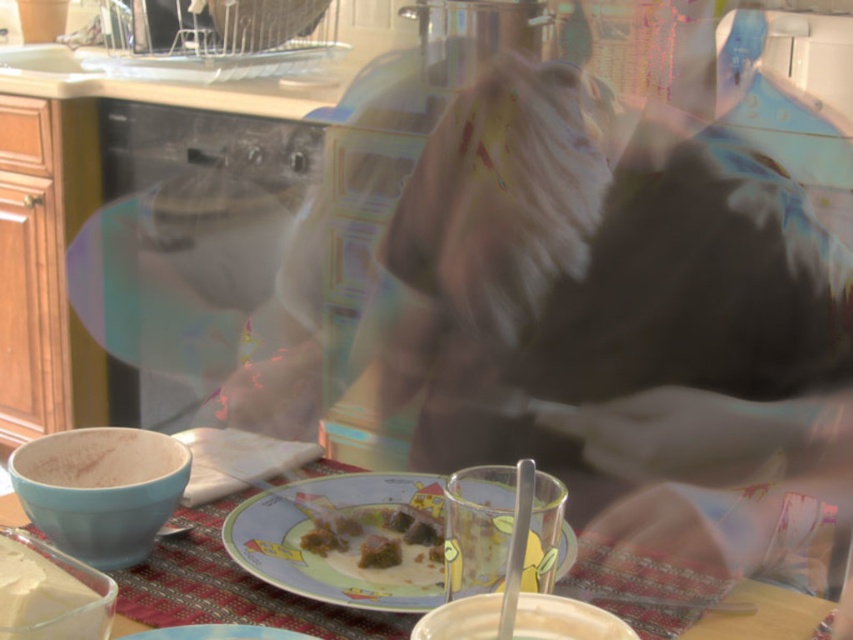
Question: Does decorative ceramic plate at center appear on the left side of smooth white cake at lower left?

Choices:
 (A) no
 (B) yes

Answer: (A)

Question: Does smooth white cake at lower left lie behind matte plastic plate at center?

Choices:
 (A) no
 (B) yes

Answer: (A)

Question: Does dark brown cake at center appear on the left side of matte plastic plate at center?

Choices:
 (A) yes
 (B) no

Answer: (B)

Question: Which of the following is the farthest from the observer?

Choices:
 (A) (759, 609)
 (B) (496, 520)
 (C) (331, 556)
 (D) (12, 545)

Answer: (C)

Question: Which point is closer to the camera?

Choices:
 (A) smooth white cake at lower left
 (B) decorative ceramic plate at center

Answer: (A)

Question: Among these objects, which one is farthest from the camera?

Choices:
 (A) decorative ceramic plate at center
 (B) smooth white cake at lower left
 (C) dark brown cake at center

Answer: (A)